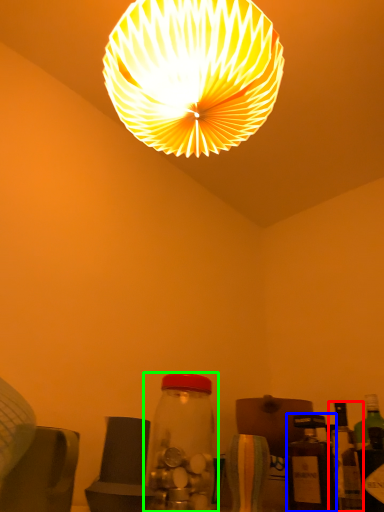
Question: Which object is positioned closest to bottle (highlighted by a red box)? Select from bottle (highlighted by a blue box) and bottle (highlighted by a green box).

Choices:
 (A) bottle
 (B) bottle

Answer: (A)